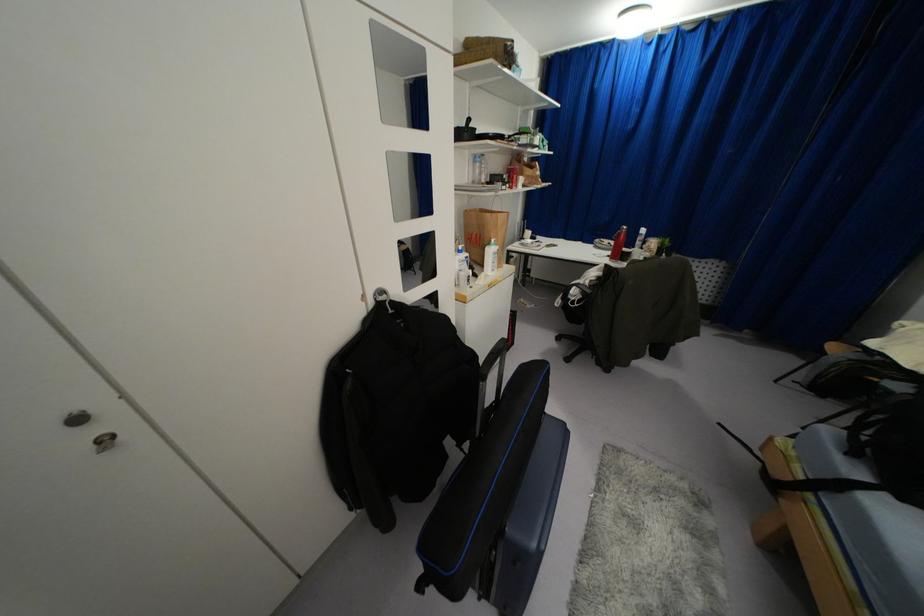
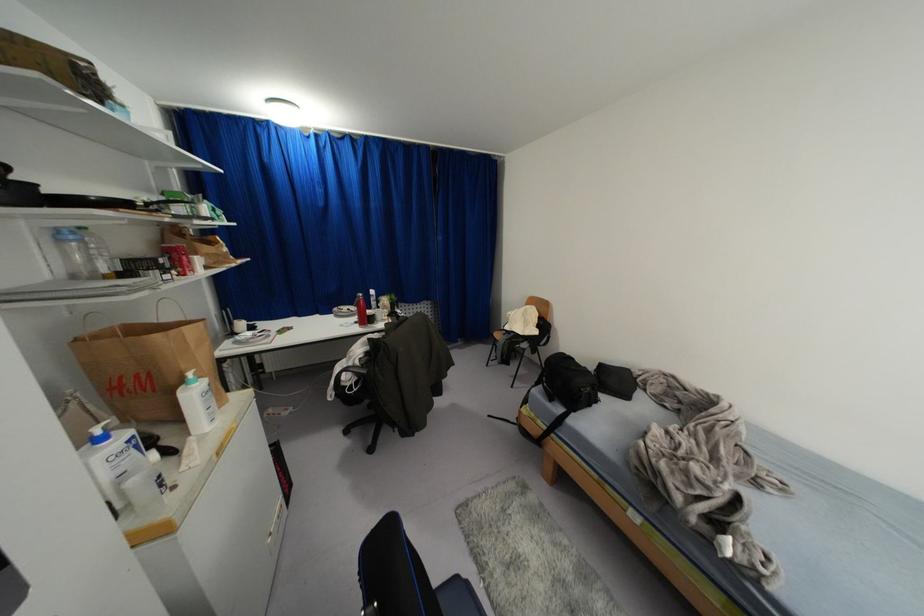
Find the pixel in the second image that matches (618,233) in the first image.

(359, 301)